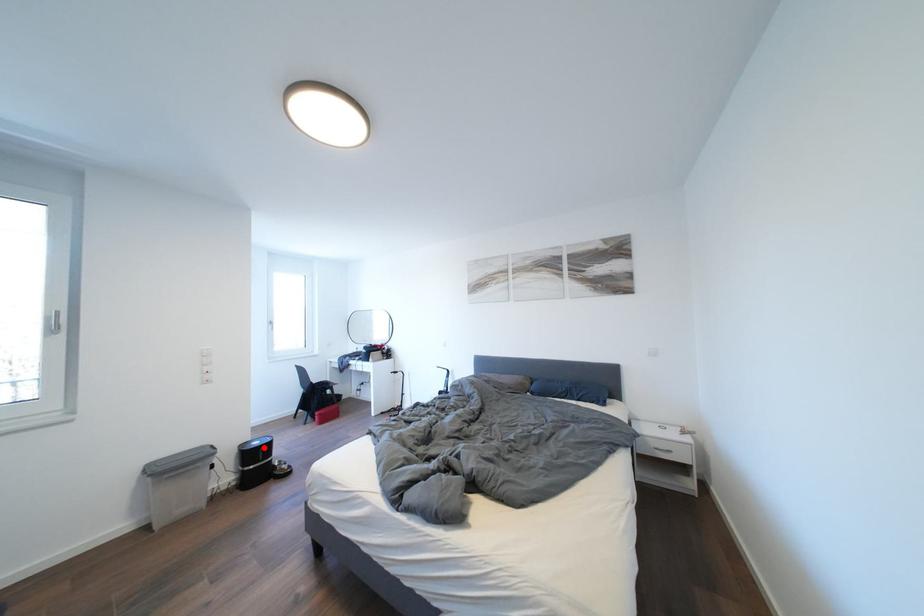
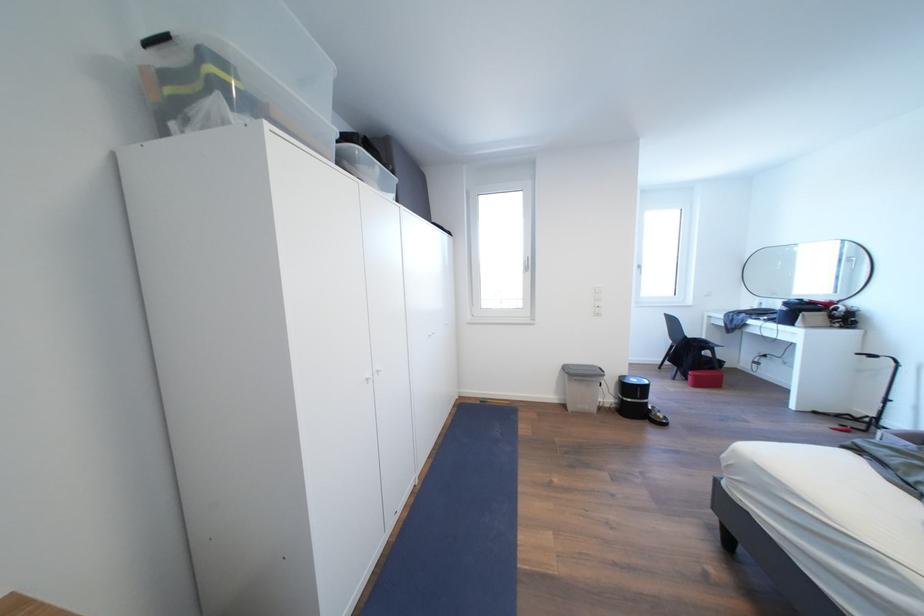
Find the pixel in the second image that matches the highlighted location in the first image.

(641, 386)